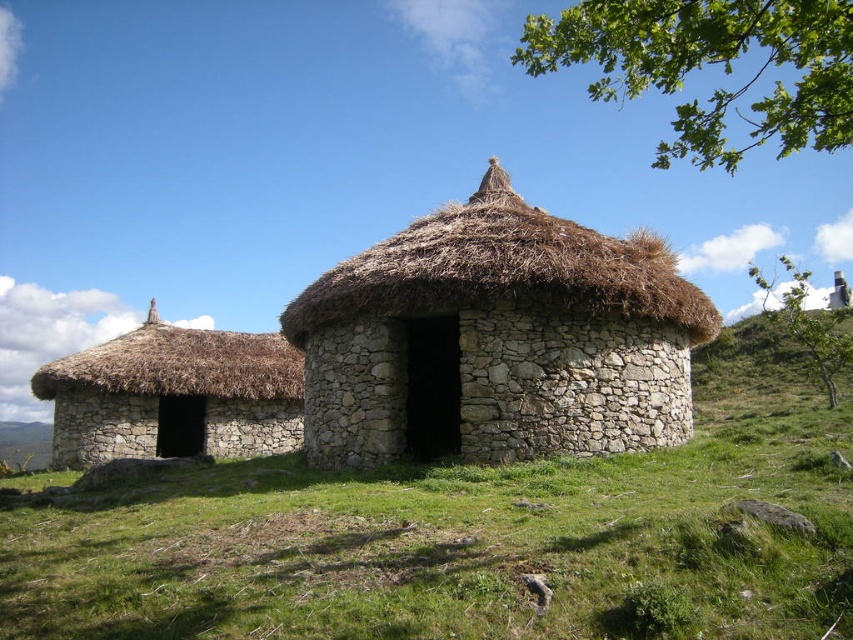
Can you confirm if green leafy branch at upper right is positioned to the right of green leafy tree at upper right?

In fact, green leafy branch at upper right is to the left of green leafy tree at upper right.

Which of these two, green leafy branch at upper right or green leafy tree at upper right, stands shorter?

green leafy tree at upper right is shorter.

What do you see at coordinates (711, 67) in the screenshot?
I see `green leafy branch at upper right` at bounding box center [711, 67].

The width and height of the screenshot is (853, 640). What are the coordinates of `green leafy branch at upper right` in the screenshot? It's located at (711, 67).

Where is `stone-thatched hut at center`? This screenshot has height=640, width=853. stone-thatched hut at center is located at coordinates (496, 339).

Locate an element on the screen. This screenshot has height=640, width=853. stone-thatched hut at center is located at coordinates (496, 339).

Locate an element on the screen. This screenshot has height=640, width=853. stone-thatched hut at center is located at coordinates (496, 339).

Between point (233, 394) and point (791, 320), which one is positioned in front?

Point (233, 394) is more forward.

What do you see at coordinates (173, 396) in the screenshot? This screenshot has height=640, width=853. I see `stone thatched hut at left` at bounding box center [173, 396].

At what (x,y) coordinates should I click in order to perform the action: click on stone thatched hut at left. Please return your answer as a coordinate pair (x, y). This screenshot has height=640, width=853. Looking at the image, I should click on (173, 396).